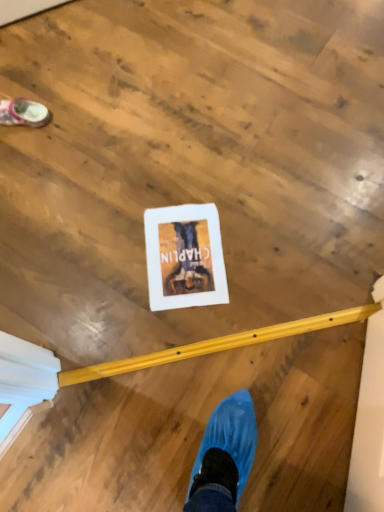
This screenshot has width=384, height=512. Find the location of `vacant space behind white paper at center`. vacant space behind white paper at center is located at coordinates (180, 179).